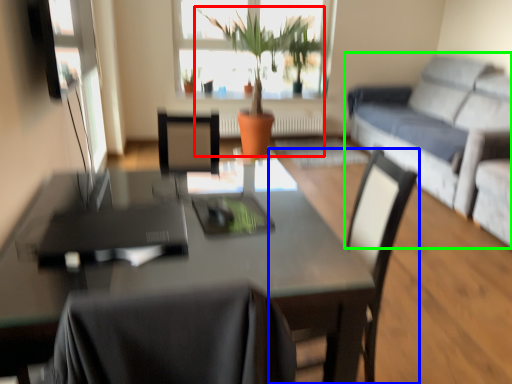
Question: Estimate the real-world distances between objects in this image. Which object is farther from houseplant (highlighted by a red box), chair (highlighted by a blue box) or studio couch (highlighted by a green box)?

Choices:
 (A) chair
 (B) studio couch

Answer: (A)